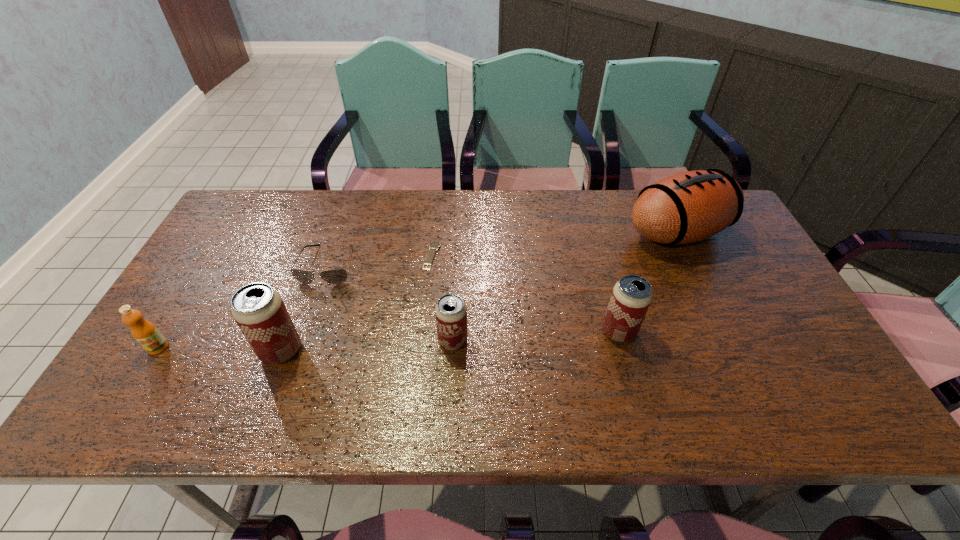
I want to click on free space between the orange juice and the leftmost beer can, so click(220, 349).

The width and height of the screenshot is (960, 540). What are the coordinates of `vacant area between the leftmost object and the rightmost beer can` in the screenshot? It's located at (389, 340).

Locate an element on the screen. free space between the football (American) and the leftmost beer can is located at coordinates (479, 292).

Identify the location of vacant point located between the second shortest object and the shortest object. This screenshot has height=540, width=960. (380, 260).

Locate an element on the screen. The height and width of the screenshot is (540, 960). vacant area that lies between the watch and the sunglasses is located at coordinates (380, 260).

Where is `vacant region between the second object from right to left and the leftmost object`? The height and width of the screenshot is (540, 960). vacant region between the second object from right to left and the leftmost object is located at coordinates (389, 340).

What are the coordinates of `blank region between the leftmost beer can and the orange juice` in the screenshot? It's located at (220, 349).

You are a GUI agent. You are given a task and a screenshot of the screen. Output one action in this format:
    pyautogui.click(x=<x>, y=<y>)
    Task: Click on the object that is the closest to the fourth object from left to right
    This screenshot has width=960, height=540.
    Given the screenshot: What is the action you would take?
    click(x=335, y=276)

Identify which object is the second nearest to the fourth object from left to right. Please provide its 2D coordinates. Your answer should be formatted as a tuple, i.e. [(x, y)], where the tuple contains the x and y coordinates of a point satisfying the conditions above.

[(451, 313)]

Locate which beer can is the closest to the sixth tallest object. Please provide its 2D coordinates. Your answer should be formatted as a tuple, i.e. [(x, y)], where the tuple contains the x and y coordinates of a point satisfying the conditions above.

[(259, 311)]